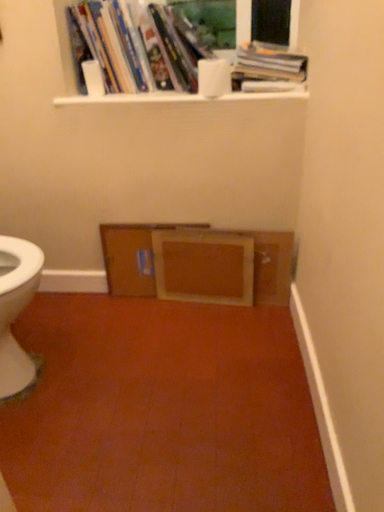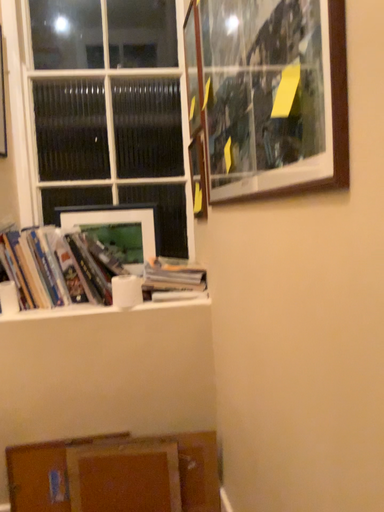
Question: How did the camera likely rotate when shooting the video?

Choices:
 (A) rotated right
 (B) rotated left

Answer: (A)